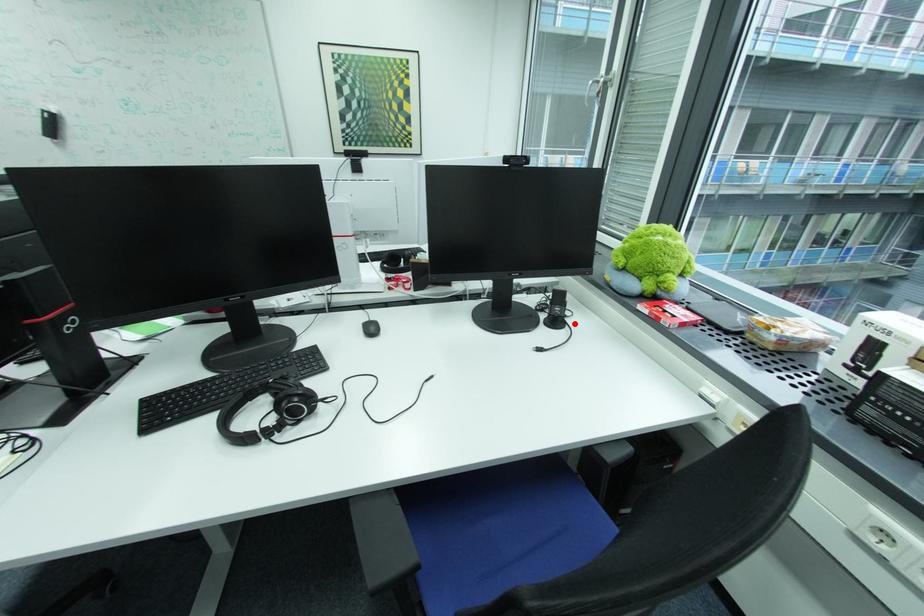
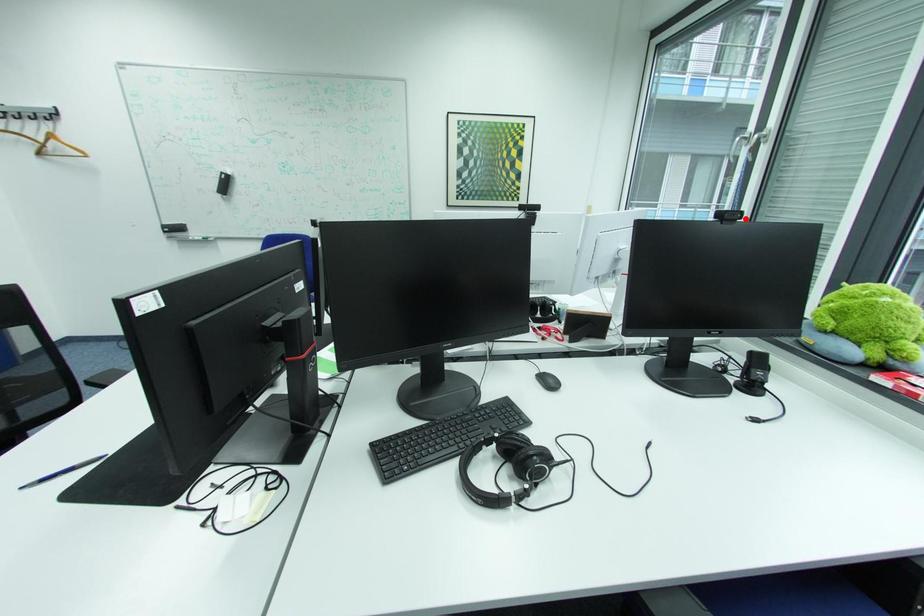
I am providing you with two images of the same scene from different viewpoints. A red point is marked on the first image and another point is marked on the second image. Is the red point in image1 aligned with the point shown in image2?

No